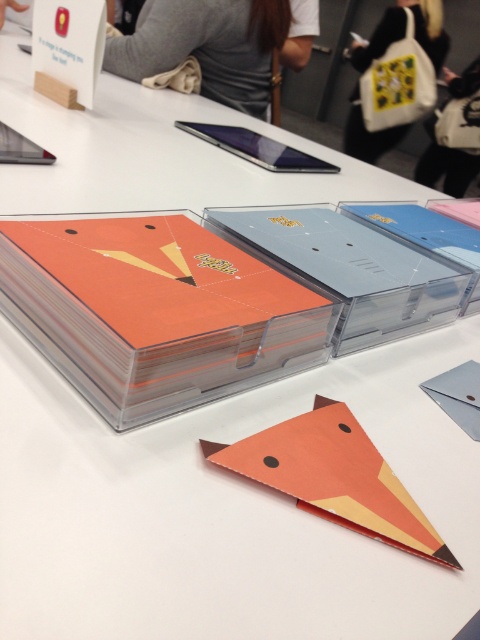
You are at an exhibition and see two points marked on the table display. The first point is at coordinate point (x=427, y=13) and the second is at point (x=458, y=152). Which point is closer to you?

Point (x=427, y=13) is closer to you because it is further to the viewer than point (x=458, y=152).

You are organizing a promotional event and need to place both the orange matte card at center and the white fabric bag at upper right on a shelf. The shelf has limited space, and you want to ensure the card is visible to attendees. Based on their current positions, which object should you move to make the card more visible?

The orange matte card at center is positioned under the white fabric bag at upper right. To make the card more visible, you should move the white fabric bag at upper right so it no longer blocks the card.